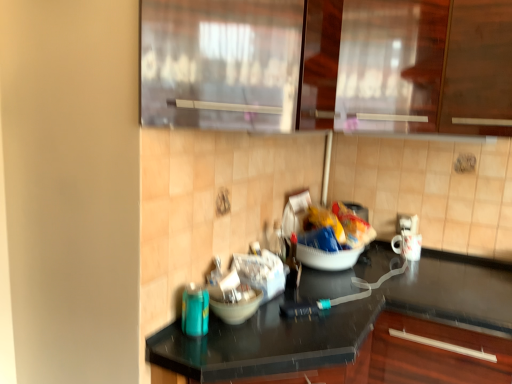
What do you see at coordinates (221, 63) in the screenshot? Image resolution: width=512 pixels, height=384 pixels. I see `transparent glass door at upper center, acting as the second glass door starting from the back` at bounding box center [221, 63].

What do you see at coordinates (391, 65) in the screenshot? I see `transparent glass cabinet at upper center, the first glass door when ordered from back to front` at bounding box center [391, 65].

What do you see at coordinates (362, 332) in the screenshot? The width and height of the screenshot is (512, 384). I see `black glossy countertop at center` at bounding box center [362, 332].

Identify the location of white glossy mug at right. This screenshot has height=384, width=512. (x=407, y=237).

Is transparent glass door at upper center, the first glass door viewed from the front, closer to camera compared to black glossy countertop at center?

No, it is not.

From a real-world perspective, who is located lower, transparent glass door at upper center, acting as the second glass door starting from the back, or black glossy countertop at center?

black glossy countertop at center.

Could black glossy countertop at center be considered to be inside transparent glass door at upper center, acting as the second glass door starting from the back?

No.

Which object is wider, transparent glass door at upper center, acting as the second glass door starting from the back, or black glossy countertop at center?

With larger width is black glossy countertop at center.

From a real-world perspective, is black glossy countertop at center physically located above or below white glossy mug at right?

Clearly, from a real-world perspective, black glossy countertop at center is below white glossy mug at right.

Can you confirm if black glossy countertop at center is wider than white glossy mug at right?

Correct, the width of black glossy countertop at center exceeds that of white glossy mug at right.

Is black glossy countertop at center looking in the opposite direction of white glossy mug at right?

No.

Can you confirm if black glossy countertop at center is positioned to the left of transparent glass cabinet at upper center, marked as the 2th glass door in a front-to-back arrangement?

Yes, black glossy countertop at center is to the left of transparent glass cabinet at upper center, marked as the 2th glass door in a front-to-back arrangement.

What are the coordinates of `the 2nd glass door behind the black glossy countertop at center, starting your count from the anchor` in the screenshot? It's located at (391, 65).

Is point (407, 311) closer to viewer compared to point (392, 125)?

Yes, it is in front of point (392, 125).

From the image's perspective, which is below, black glossy countertop at center or transparent glass cabinet at upper center, marked as the 2th glass door in a front-to-back arrangement?

black glossy countertop at center, from the image's perspective.

Is black glossy countertop at center at the back of transparent glass cabinet at upper center, marked as the 2th glass door in a front-to-back arrangement?

No, transparent glass cabinet at upper center, marked as the 2th glass door in a front-to-back arrangement, is not facing away from black glossy countertop at center.

From the image's perspective, which is below, transparent glass cabinet at upper center, marked as the 2th glass door in a front-to-back arrangement, or black glossy countertop at center?

black glossy countertop at center appears lower in the image.

Is transparent glass cabinet at upper center, marked as the 2th glass door in a front-to-back arrangement, located outside black glossy countertop at center?

Absolutely, transparent glass cabinet at upper center, marked as the 2th glass door in a front-to-back arrangement, is external to black glossy countertop at center.

Is transparent glass cabinet at upper center, the first glass door when ordered from back to front, not near black glossy countertop at center?

transparent glass cabinet at upper center, the first glass door when ordered from back to front, is near black glossy countertop at center, not far away.

From a real-world perspective, which object stands above the other?

matte white bowl at center.

Which point is more distant from viewer, (467, 290) or (248, 301)?

The point (467, 290) is more distant.

From the image's perspective, is black glossy countertop at center below matte white bowl at center?

Correct, black glossy countertop at center appears lower than matte white bowl at center in the image.

From the picture: Are black glossy countertop at center and matte white bowl at center making contact?

No, black glossy countertop at center is not with matte white bowl at center.

You are a GUI agent. You are given a task and a screenshot of the screen. Output one action in this format:
    pyautogui.click(x=<x>, y=<y>)
    Task: Click on the appliance on the right of transparent glass door at upper center, the first glass door viewed from the front
    Image resolution: width=512 pixels, height=384 pixels.
    Given the screenshot: What is the action you would take?
    pyautogui.click(x=407, y=237)

Is transparent glass door at upper center, the first glass door viewed from the front, at the left side of white glossy mug at right?

Yes.

Is point (176, 87) in front of point (398, 242)?

Yes, it is.

Can we say transparent glass cabinet at upper center, marked as the 2th glass door in a front-to-back arrangement, lies outside matte white bowl at center?

transparent glass cabinet at upper center, marked as the 2th glass door in a front-to-back arrangement, is positioned outside matte white bowl at center.

Who is shorter, transparent glass cabinet at upper center, marked as the 2th glass door in a front-to-back arrangement, or matte white bowl at center?

Standing shorter between the two is matte white bowl at center.

Which object is wider, transparent glass cabinet at upper center, marked as the 2th glass door in a front-to-back arrangement, or matte white bowl at center?

Wider between the two is transparent glass cabinet at upper center, marked as the 2th glass door in a front-to-back arrangement.

From a real-world perspective, between transparent glass cabinet at upper center, the first glass door when ordered from back to front, and matte white bowl at center, who is vertically higher?

transparent glass cabinet at upper center, the first glass door when ordered from back to front.

From a real-world perspective, starting from the black glossy countertop at center, which glass door is the 1st one vertically above it? Please provide its 2D coordinates.

[(221, 63)]

Identify the location of appliance that is above the black glossy countertop at center (from the image's perspective). (407, 237).

Based on their spatial positions, is white glossy mug at right or transparent glass door at upper center, the first glass door viewed from the front, closer to matte white bowl at center?

transparent glass door at upper center, the first glass door viewed from the front.

Estimate the real-world distances between objects in this image. Which object is closer to white glossy mug at right, transparent glass cabinet at upper center, the first glass door when ordered from back to front, or black glossy countertop at center?

black glossy countertop at center is closer to white glossy mug at right.

Looking at this image, estimate the real-world distances between objects in this image. Which object is closer to transparent glass door at upper center, acting as the second glass door starting from the back, yellow crinkled chips at center or white glossy mug at right?

yellow crinkled chips at center.

From the image, which object appears to be nearer to transparent glass cabinet at upper center, marked as the 2th glass door in a front-to-back arrangement, black glossy countertop at center or matte white bowl at center?

The object closer to transparent glass cabinet at upper center, marked as the 2th glass door in a front-to-back arrangement, is black glossy countertop at center.

Which object lies further to the anchor point matte white bowl at center, white glossy mug at right or black glossy countertop at center?

white glossy mug at right is further to matte white bowl at center.

Based on their spatial positions, is white glossy mug at right or matte white bowl at center further from black glossy countertop at center?

white glossy mug at right.

Estimate the real-world distances between objects in this image. Which object is closer to yellow crinkled chips at center, matte white bowl at center or white glossy mug at right?

white glossy mug at right.

Looking at the image, which one is located closer to black glossy countertop at center, transparent glass cabinet at upper center, the first glass door when ordered from back to front, or matte white bowl at center?

matte white bowl at center is closer to black glossy countertop at center.

Where is `food between transparent glass cabinet at upper center, the first glass door when ordered from back to front, and black glossy countertop at center in the up-down direction`? This screenshot has width=512, height=384. food between transparent glass cabinet at upper center, the first glass door when ordered from back to front, and black glossy countertop at center in the up-down direction is located at coordinates (341, 224).

Where is `appliance between transparent glass cabinet at upper center, marked as the 2th glass door in a front-to-back arrangement, and black glossy countertop at center in the up-down direction`? appliance between transparent glass cabinet at upper center, marked as the 2th glass door in a front-to-back arrangement, and black glossy countertop at center in the up-down direction is located at coordinates (407, 237).

Image resolution: width=512 pixels, height=384 pixels. In order to click on mixing bowl between transparent glass door at upper center, the first glass door viewed from the front, and black glossy countertop at center vertically in this screenshot , I will do `click(236, 309)`.

The width and height of the screenshot is (512, 384). I want to click on glass door located between transparent glass door at upper center, the first glass door viewed from the front, and yellow crinkled chips at center in the depth direction, so click(391, 65).